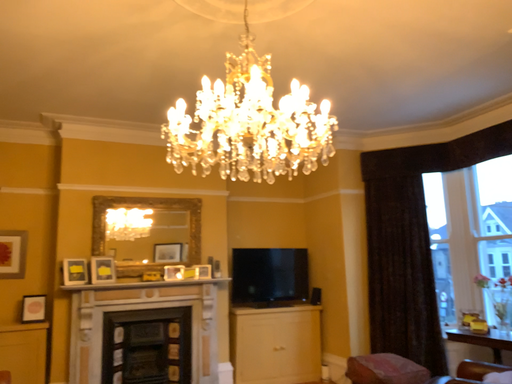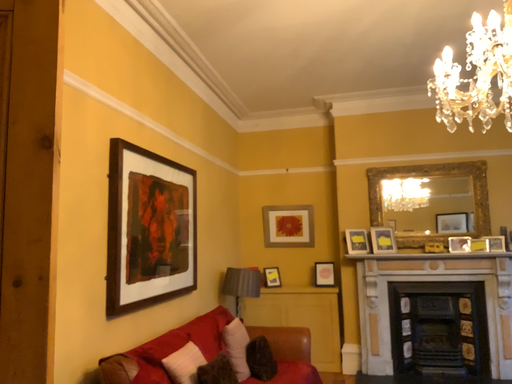
Question: Which way did the camera rotate in the video?

Choices:
 (A) rotated right
 (B) rotated left

Answer: (B)